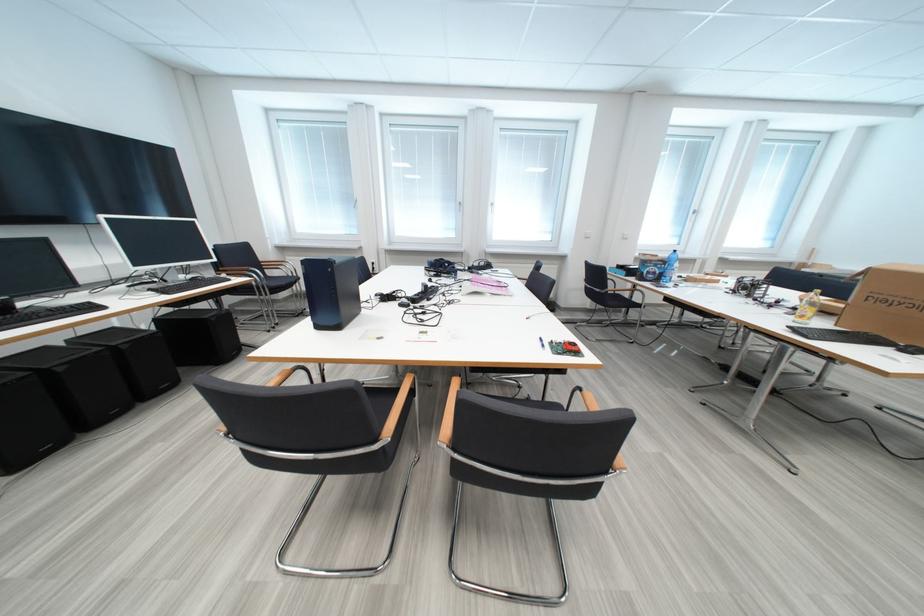
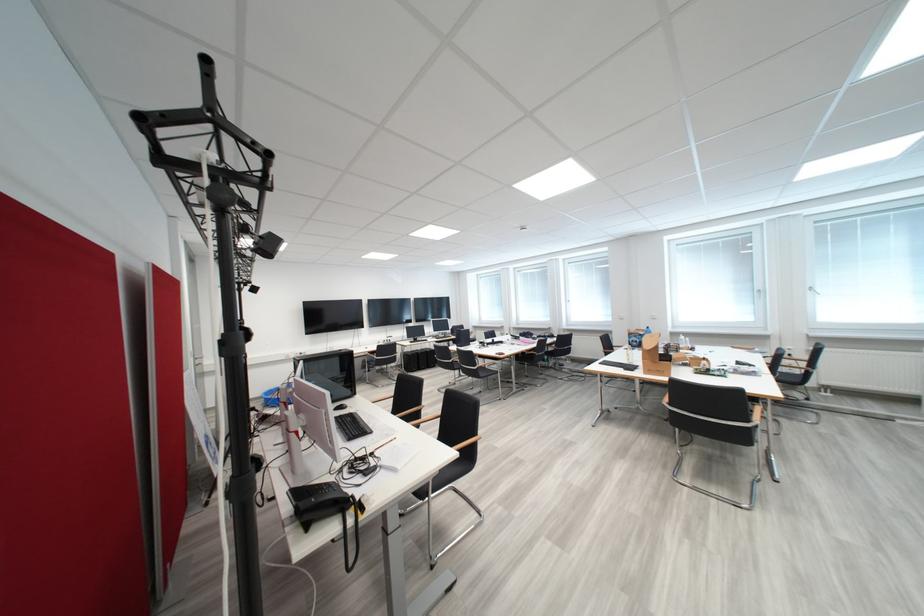
Find the pixel in the second image that matches (x=675, y=265) in the first image.

(650, 337)